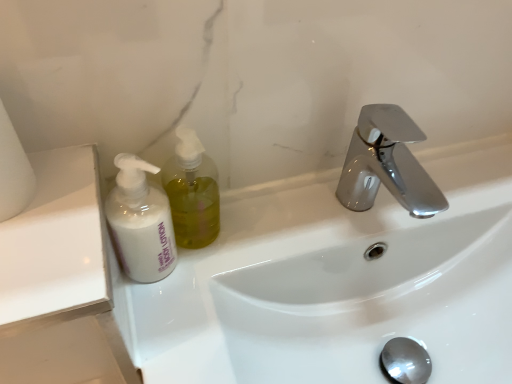
Question: Can you confirm if white matte lotion at left is taller than translucent yellow liquid at left?

Choices:
 (A) yes
 (B) no

Answer: (A)

Question: From a real-world perspective, is white matte lotion at left over translucent yellow liquid at left?

Choices:
 (A) yes
 (B) no

Answer: (B)

Question: Is white matte lotion at left placed right next to translucent yellow liquid at left?

Choices:
 (A) no
 (B) yes

Answer: (B)

Question: Is white matte lotion at left thinner than translucent yellow liquid at left?

Choices:
 (A) no
 (B) yes

Answer: (A)

Question: Can you confirm if white matte lotion at left is positioned to the left of translucent yellow liquid at left?

Choices:
 (A) no
 (B) yes

Answer: (B)

Question: From the image's perspective, relative to white matte toilet paper at left, is translucent yellow liquid at left above or below?

Choices:
 (A) below
 (B) above

Answer: (A)

Question: Based on their sizes in the image, would you say translucent yellow liquid at left is bigger or smaller than white matte toilet paper at left?

Choices:
 (A) big
 (B) small

Answer: (B)

Question: From a real-world perspective, is translucent yellow liquid at left physically located above or below white matte toilet paper at left?

Choices:
 (A) below
 (B) above

Answer: (A)

Question: Is translucent yellow liquid at left in front of or behind white matte toilet paper at left in the image?

Choices:
 (A) behind
 (B) front

Answer: (A)

Question: In terms of size, does white matte lotion at left appear bigger or smaller than translucent yellow liquid at left?

Choices:
 (A) small
 (B) big

Answer: (B)

Question: Considering the relative positions of white matte lotion at left and translucent yellow liquid at left in the image provided, is white matte lotion at left to the left or to the right of translucent yellow liquid at left?

Choices:
 (A) right
 (B) left

Answer: (B)

Question: In the image, is white matte lotion at left positioned in front of or behind translucent yellow liquid at left?

Choices:
 (A) front
 (B) behind

Answer: (A)

Question: Is point (144, 187) positioned closer to the camera than point (179, 236)?

Choices:
 (A) closer
 (B) farther

Answer: (A)

Question: Is point (5, 157) closer or farther from the camera than point (129, 228)?

Choices:
 (A) farther
 (B) closer

Answer: (B)

Question: From a real-world perspective, is white matte toilet paper at left above or below white matte lotion at left?

Choices:
 (A) below
 (B) above

Answer: (B)